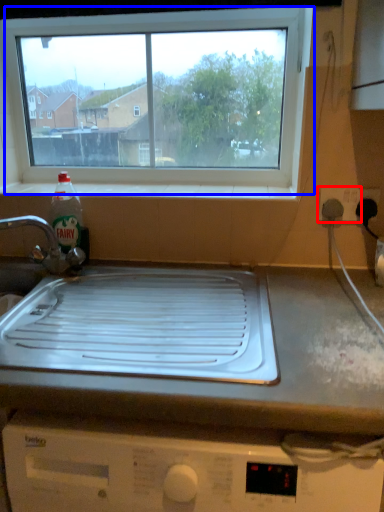
Question: Which object appears closest to the camera in this image, electric outlet (highlighted by a red box) or window (highlighted by a blue box)?

Choices:
 (A) electric outlet
 (B) window

Answer: (A)